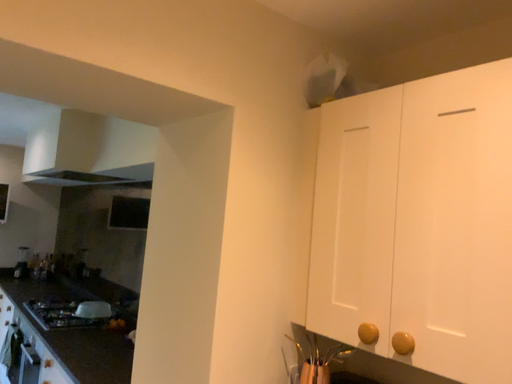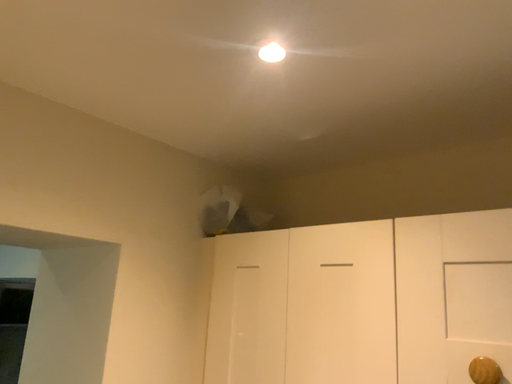
Question: Which way did the camera rotate in the video?

Choices:
 (A) rotated left
 (B) rotated right

Answer: (B)